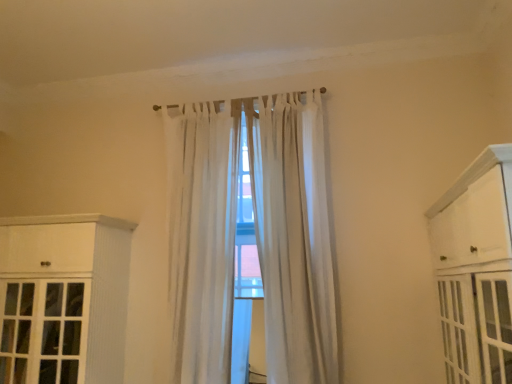
Question: Is white sheer curtain at center, placed as the first curtain when sorted from right to left, bigger than white wood cabinet at left, the first cabinetry when ordered from left to right?

Choices:
 (A) no
 (B) yes

Answer: (A)

Question: Is white sheer curtain at center, placed as the second curtain when sorted from left to right, smaller than white wood cabinet at left, the first cabinetry when ordered from left to right?

Choices:
 (A) yes
 (B) no

Answer: (A)

Question: Is white sheer curtain at center, placed as the second curtain when sorted from left to right, shorter than white wood cabinet at left, which ranks as the first cabinetry in back-to-front order?

Choices:
 (A) no
 (B) yes

Answer: (A)

Question: Is the position of white sheer curtain at center, placed as the first curtain when sorted from right to left, less distant than that of white wood cabinet at left, which ranks as the first cabinetry in back-to-front order?

Choices:
 (A) no
 (B) yes

Answer: (A)

Question: From the image's perspective, does white sheer curtain at center, placed as the first curtain when sorted from right to left, appear lower than white wood cabinet at left, which is counted as the 2th cabinetry, starting from the front?

Choices:
 (A) yes
 (B) no

Answer: (B)

Question: From a real-world perspective, is white sheer curtain at center, placed as the first curtain when sorted from right to left, under white wood cabinet at left, the first cabinetry when ordered from left to right?

Choices:
 (A) yes
 (B) no

Answer: (B)

Question: Are white painted wood cabinet at right, positioned as the second cabinetry in left-to-right order, and white sheer curtain at center, the 1th curtain when ordered from left to right, making contact?

Choices:
 (A) yes
 (B) no

Answer: (B)

Question: Is white sheer curtain at center, which ranks as the 2th curtain in right-to-left order, a part of white painted wood cabinet at right, positioned as the second cabinetry in left-to-right order?

Choices:
 (A) yes
 (B) no

Answer: (B)

Question: From a real-world perspective, is white painted wood cabinet at right, arranged as the 2th cabinetry when viewed from the back, positioned under white sheer curtain at center, the 1th curtain when ordered from left to right, based on gravity?

Choices:
 (A) yes
 (B) no

Answer: (A)

Question: Does white painted wood cabinet at right, which is the first cabinetry in front-to-back order, come in front of white sheer curtain at center, the 1th curtain when ordered from left to right?

Choices:
 (A) no
 (B) yes

Answer: (B)

Question: Could you tell me if white painted wood cabinet at right, arranged as the 2th cabinetry when viewed from the back, is turned towards white sheer curtain at center, the 1th curtain when ordered from left to right?

Choices:
 (A) yes
 (B) no

Answer: (A)

Question: Can you confirm if white painted wood cabinet at right, arranged as the 2th cabinetry when viewed from the back, is positioned to the right of white sheer curtain at center, which ranks as the 2th curtain in right-to-left order?

Choices:
 (A) no
 (B) yes

Answer: (B)

Question: From a real-world perspective, is white sheer curtain at center, the 1th curtain when ordered from left to right, physically below white sheer curtain at center, placed as the first curtain when sorted from right to left?

Choices:
 (A) yes
 (B) no

Answer: (A)